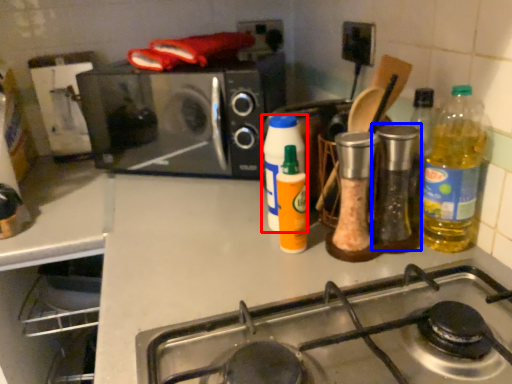
Question: Which of the following is the farthest to the observer, bottle (highlighted by a red box) or bottle (highlighted by a blue box)?

Choices:
 (A) bottle
 (B) bottle

Answer: (A)